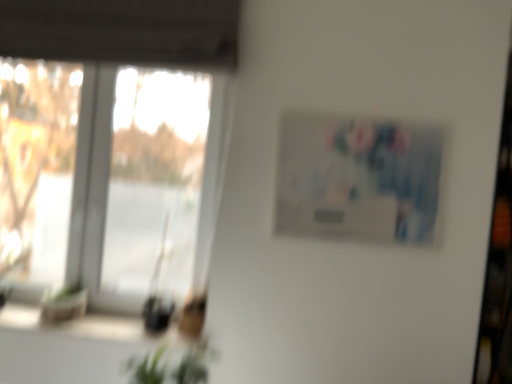
Question: From the image's perspective, is matte plastic picture frame at upper right below transparent glass window at left?

Choices:
 (A) no
 (B) yes

Answer: (A)

Question: Is matte plastic picture frame at upper right not within transparent glass window at left?

Choices:
 (A) no
 (B) yes

Answer: (B)

Question: Can you confirm if matte plastic picture frame at upper right is thinner than transparent glass window at left?

Choices:
 (A) no
 (B) yes

Answer: (B)

Question: Can transparent glass window at left be found inside matte plastic picture frame at upper right?

Choices:
 (A) yes
 (B) no

Answer: (B)

Question: Is matte plastic picture frame at upper right oriented towards transparent glass window at left?

Choices:
 (A) yes
 (B) no

Answer: (B)

Question: Does matte plastic picture frame at upper right lie in front of transparent glass window at left?

Choices:
 (A) no
 (B) yes

Answer: (B)

Question: Considering the relative positions of transparent glass window at left and matte plastic picture frame at upper right in the image provided, is transparent glass window at left behind matte plastic picture frame at upper right?

Choices:
 (A) no
 (B) yes

Answer: (B)

Question: From a real-world perspective, is transparent glass window at left on matte plastic picture frame at upper right?

Choices:
 (A) yes
 (B) no

Answer: (B)

Question: From the image's perspective, is transparent glass window at left above matte plastic picture frame at upper right?

Choices:
 (A) yes
 (B) no

Answer: (B)

Question: Can you confirm if transparent glass window at left is positioned to the left of matte plastic picture frame at upper right?

Choices:
 (A) yes
 (B) no

Answer: (A)

Question: Considering the relative sizes of transparent glass window at left and matte plastic picture frame at upper right in the image provided, is transparent glass window at left bigger than matte plastic picture frame at upper right?

Choices:
 (A) no
 (B) yes

Answer: (B)

Question: From the image's perspective, is transparent glass window at left located beneath matte plastic picture frame at upper right?

Choices:
 (A) no
 (B) yes

Answer: (B)

Question: Can transparent glass window at left be found inside green leafy plant at lower center?

Choices:
 (A) no
 (B) yes

Answer: (A)